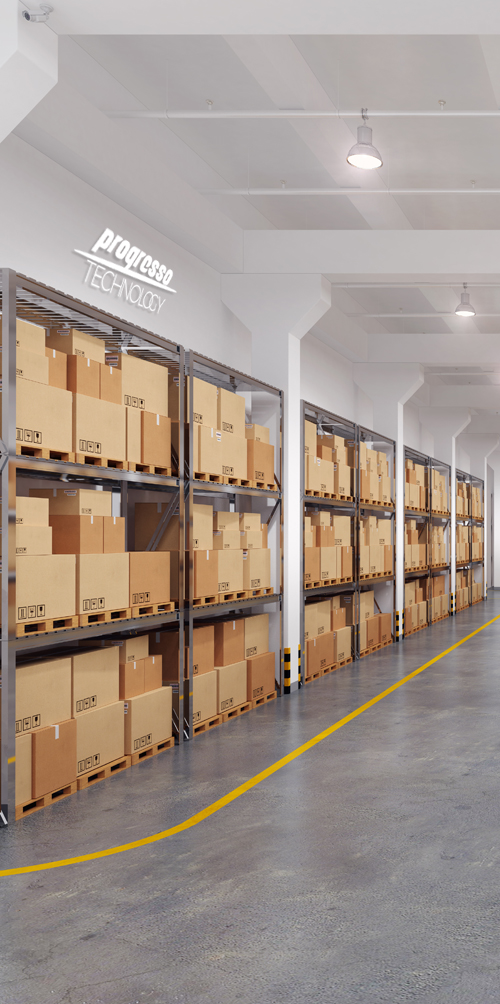
The height and width of the screenshot is (1004, 500). I want to click on rack, so click(x=140, y=478), click(x=239, y=487), click(x=329, y=501), click(x=382, y=506), click(x=418, y=510), click(x=441, y=513).